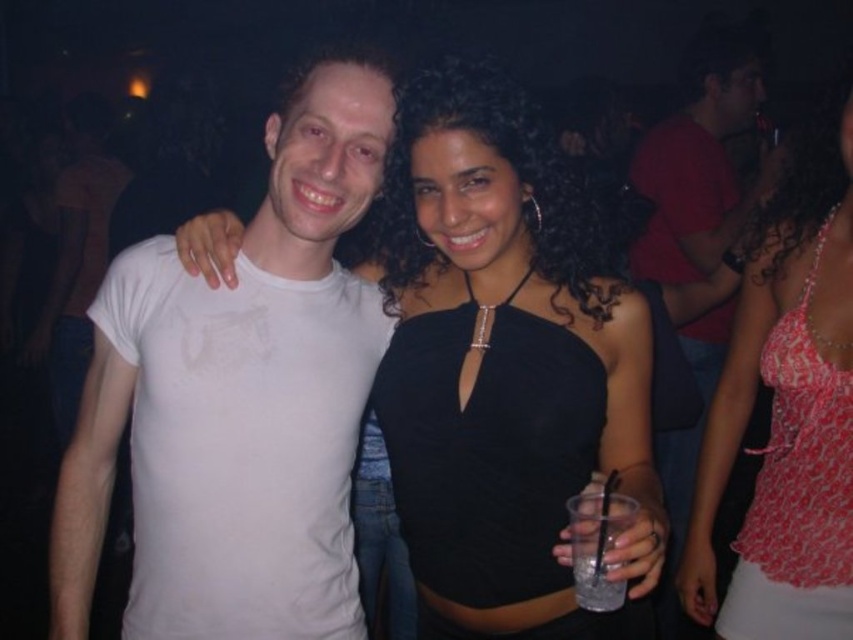
You are a photographer at the event and need to capture both the black satin dress at center and the pink lace top at center in a single frame. Since the camera can only focus on one subject at a time, which item should you prioritize to ensure it fits entirely within the frame?

The black satin dress at center is larger in size than the pink lace top at center, so you should prioritize focusing on the black satin dress at center to ensure it fits entirely within the frame.

You are a bartender at the nightclub and need to place a new drink order on the table between the black satin dress at center and the clear plastic cup at center. Where should you place the drink so that it is equidistant from both items?

The black satin dress at center is positioned on the left side of the clear plastic cup at center. To place the drink equidistant from both, position it exactly halfway between them along the line connecting their centers.